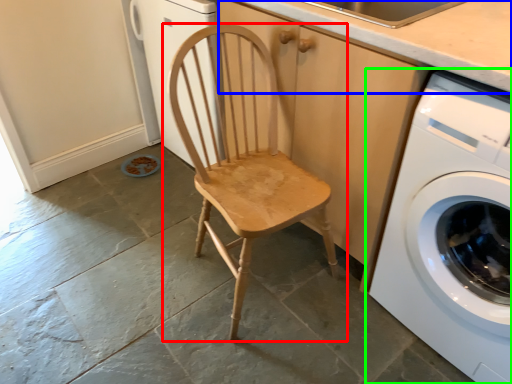
Question: Based on their relative distances, which object is nearer to chair (highlighted by a red box)? Choose from counter top (highlighted by a blue box) and washing machine (highlighted by a green box).

Choices:
 (A) counter top
 (B) washing machine

Answer: (B)